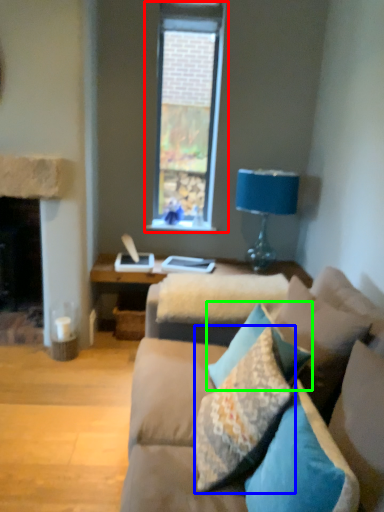
Question: Which object is the farthest from window (highlighted by a red box)? Choose among these: pillow (highlighted by a blue box) or pillow (highlighted by a green box).

Choices:
 (A) pillow
 (B) pillow

Answer: (A)